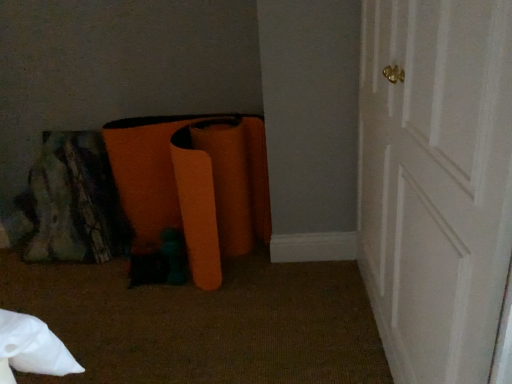
Where is `vacant area in front of orange fabric bean bag at lower left`? The height and width of the screenshot is (384, 512). vacant area in front of orange fabric bean bag at lower left is located at coordinates (205, 323).